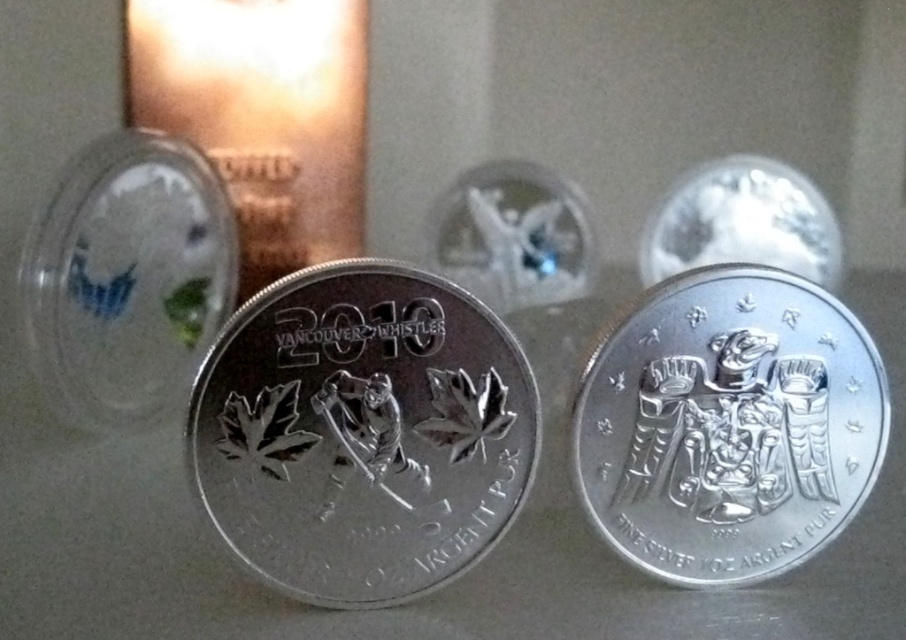
Who is shorter, silver/metallic coin at center or silver/metallic eagle at center?

Standing shorter between the two is silver/metallic eagle at center.

Which is more to the left, silver/metallic coin at center or silver/metallic eagle at center?

Positioned to the left is silver/metallic coin at center.

Based on the photo, who is more forward, (374,308) or (829,332)?

Point (374,308) is in front.

Where is `silver/metallic coin at center`? This screenshot has width=906, height=640. silver/metallic coin at center is located at coordinates (362, 433).